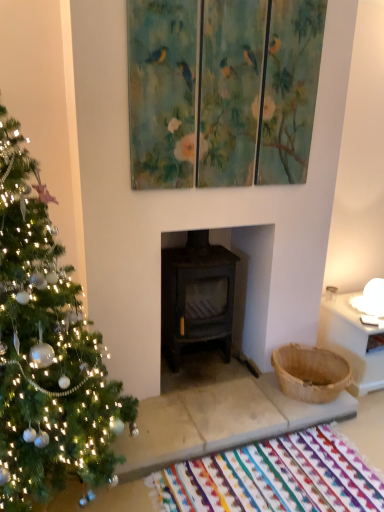
The image size is (384, 512). What do you see at coordinates (222, 91) in the screenshot?
I see `painted wood triptych at upper center` at bounding box center [222, 91].

What do you see at coordinates (275, 478) in the screenshot? The image size is (384, 512). I see `multicolored woven mat at lower center` at bounding box center [275, 478].

The image size is (384, 512). What do you see at coordinates (47, 351) in the screenshot? I see `green matte christmas tree at left` at bounding box center [47, 351].

Find the location of a particular element. painted wood triptych at upper center is located at coordinates (222, 91).

Is green matte christmas tree at left located within multicolored woven mat at lower center?

No, green matte christmas tree at left is not surrounded by multicolored woven mat at lower center.

From a real-world perspective, is multicolored woven mat at lower center physically located above or below green matte christmas tree at left?

multicolored woven mat at lower center is situated lower than green matte christmas tree at left in the real world.

Considering the sizes of objects multicolored woven mat at lower center and green matte christmas tree at left in the image provided, who is bigger, multicolored woven mat at lower center or green matte christmas tree at left?

Bigger between the two is green matte christmas tree at left.

Which object is closer to the camera taking this photo, multicolored woven mat at lower center or green matte christmas tree at left?

green matte christmas tree at left is in front.

Is green matte christmas tree at left looking in the opposite direction of painted wood triptych at upper center?

green matte christmas tree at left is not turned away from painted wood triptych at upper center.

Which is behind, point (51, 347) or point (237, 91)?

The point (237, 91) is farther from the camera.

Consider the image. How much distance is there between painted wood triptych at upper center and multicolored woven mat at lower center?

1.60 meters.

From the image's perspective, who appears lower, painted wood triptych at upper center or multicolored woven mat at lower center?

multicolored woven mat at lower center.

Is painted wood triptych at upper center turned away from multicolored woven mat at lower center?

That's not correct — painted wood triptych at upper center is not looking away from multicolored woven mat at lower center.

Does painted wood triptych at upper center touch multicolored woven mat at lower center?

No, painted wood triptych at upper center is not beside multicolored woven mat at lower center.

Which point is more distant from viewer, (50, 324) or (263, 451)?

The point (263, 451) is behind.

From a real-world perspective, relative to multicolored woven mat at lower center, is green matte christmas tree at left vertically above or below?

In terms of real-world spatial position, green matte christmas tree at left is above multicolored woven mat at lower center.

What's the angular difference between green matte christmas tree at left and multicolored woven mat at lower center's facing directions?

They differ by 0.723 degrees in their facing directions.

Which is more to the left, green matte christmas tree at left or multicolored woven mat at lower center?

Answer: green matte christmas tree at left.

Is painted wood triptych at upper center far away from green matte christmas tree at left?

That's not correct — painted wood triptych at upper center is a little close to green matte christmas tree at left.

Is point (305, 123) closer or farther from the camera than point (19, 479)?

Point (305, 123) is positioned farther from the camera compared to point (19, 479).

In the scene shown: Is painted wood triptych at upper center oriented towards green matte christmas tree at left?

No, painted wood triptych at upper center does not turn towards green matte christmas tree at left.

Which of these two, painted wood triptych at upper center or green matte christmas tree at left, is thinner?

painted wood triptych at upper center.

From the image's perspective, would you say multicolored woven mat at lower center is positioned over painted wood triptych at upper center?

No.

Do you think multicolored woven mat at lower center is within painted wood triptych at upper center, or outside of it?

multicolored woven mat at lower center is located beyond the bounds of painted wood triptych at upper center.

Considering the positions of objects multicolored woven mat at lower center and painted wood triptych at upper center in the image provided, who is behind, multicolored woven mat at lower center or painted wood triptych at upper center?

painted wood triptych at upper center is behind.

The image size is (384, 512). Identify the location of mat beneath the green matte christmas tree at left (from a real-world perspective). (275, 478).

This screenshot has width=384, height=512. I want to click on picture frame that appears on the right of green matte christmas tree at left, so click(222, 91).

Looking at the image, which one is located closer to multicolored woven mat at lower center, green matte christmas tree at left or painted wood triptych at upper center?

green matte christmas tree at left is closer to multicolored woven mat at lower center.

When comparing their distances from green matte christmas tree at left, does multicolored woven mat at lower center or painted wood triptych at upper center seem further?

painted wood triptych at upper center.

Estimate the real-world distances between objects in this image. Which object is closer to painted wood triptych at upper center, green matte christmas tree at left or multicolored woven mat at lower center?

green matte christmas tree at left.

Which object lies further to the anchor point green matte christmas tree at left, painted wood triptych at upper center or multicolored woven mat at lower center?

The object further to green matte christmas tree at left is painted wood triptych at upper center.

Considering their positions, is painted wood triptych at upper center positioned further to multicolored woven mat at lower center than green matte christmas tree at left?

painted wood triptych at upper center lies further to multicolored woven mat at lower center than the other object.

From the picture: Estimate the real-world distances between objects in this image. Which object is further from painted wood triptych at upper center, multicolored woven mat at lower center or green matte christmas tree at left?

multicolored woven mat at lower center lies further to painted wood triptych at upper center than the other object.

You are a GUI agent. You are given a task and a screenshot of the screen. Output one action in this format:
    pyautogui.click(x=<x>, y=<y>)
    Task: Click on the christmas tree between painted wood triptych at upper center and multicolored woven mat at lower center in the up-down direction
    The height and width of the screenshot is (512, 384).
    Given the screenshot: What is the action you would take?
    pyautogui.click(x=47, y=351)